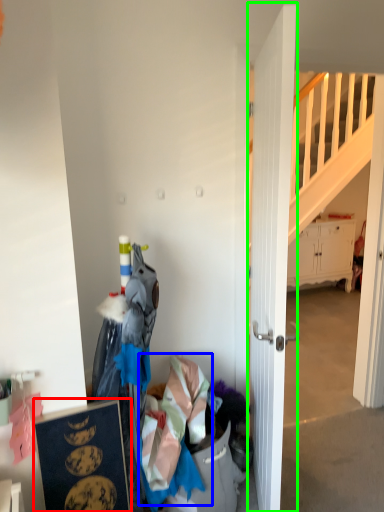
Question: Which object is positioned closest to picture frame (highlighted by a red box)? Select from clothing (highlighted by a blue box) and door (highlighted by a green box).

Choices:
 (A) clothing
 (B) door

Answer: (A)